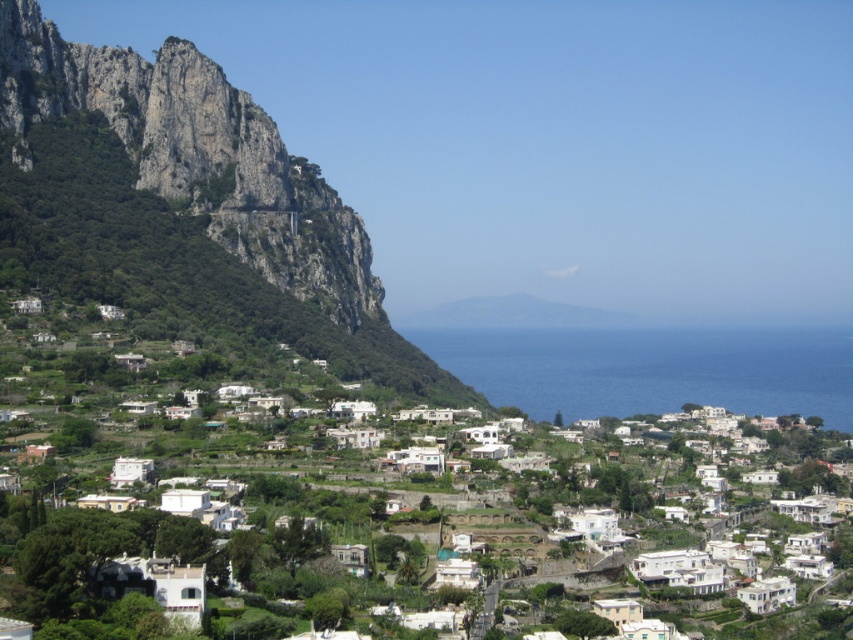
Question: Which point is farther from the camera taking this photo?

Choices:
 (A) (756, 372)
 (B) (802, 324)

Answer: (B)

Question: Among these objects, which one is nearest to the camera?

Choices:
 (A) blue liquid water at center
 (B) white matte houses at center
 (C) rugged stone mountain at left

Answer: (B)

Question: Which point appears closest to the camera in this image?

Choices:
 (A) (386, 326)
 (B) (595, 364)

Answer: (A)

Question: In this image, where is white matte houses at center located relative to blue liquid water at center?

Choices:
 (A) above
 (B) below

Answer: (A)

Question: Can you confirm if white matte houses at center is smaller than blue liquid water at center?

Choices:
 (A) yes
 (B) no

Answer: (B)

Question: In this image, where is white matte houses at center located relative to blue liquid water at center?

Choices:
 (A) left
 (B) right

Answer: (A)